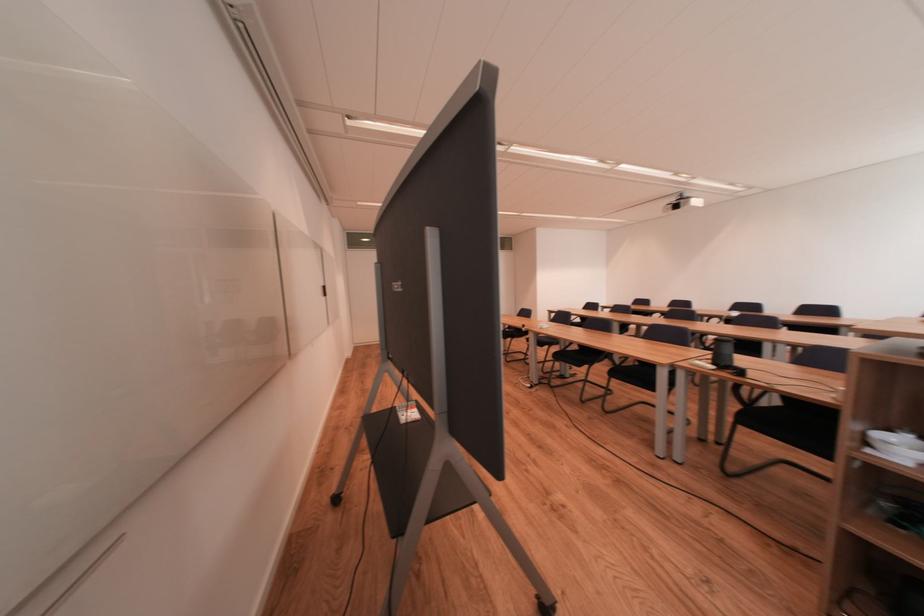
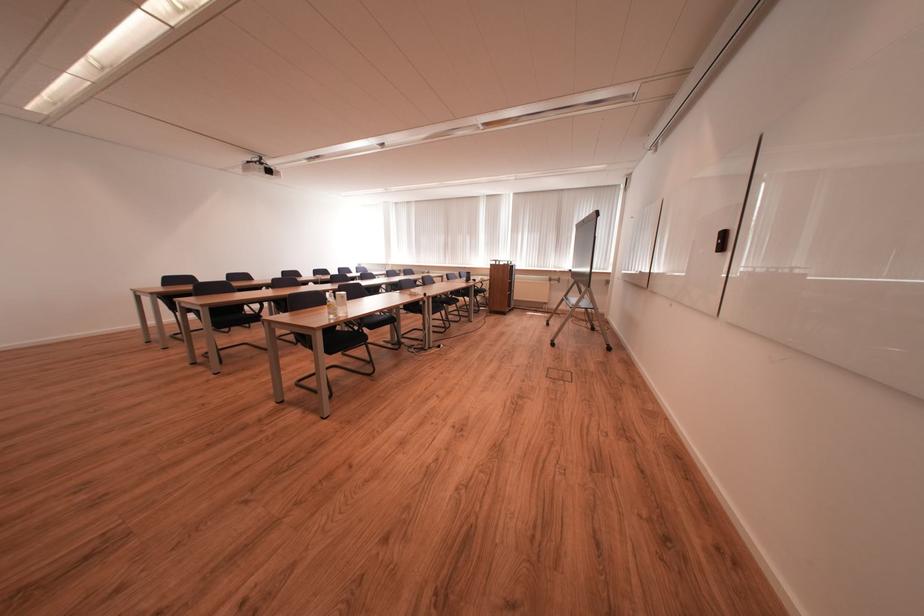
The point at (685, 208) is marked in the first image. Where is the corresponding point in the second image?

(277, 174)